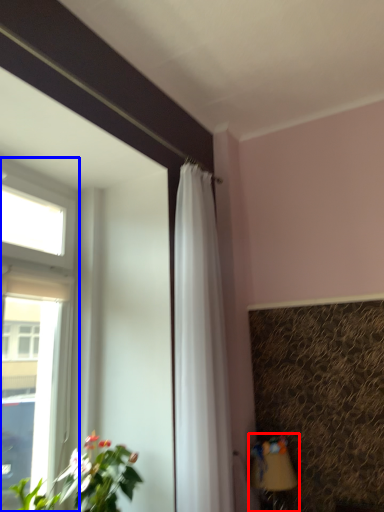
Question: Which of the following is the farthest to the observer, table lamp (highlighted by a red box) or window (highlighted by a blue box)?

Choices:
 (A) table lamp
 (B) window

Answer: (A)